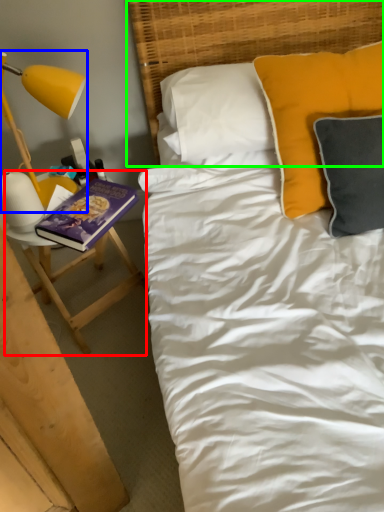
Question: Which is nearer to the table (highlighted by a red box)? lamp (highlighted by a blue box) or headboard (highlighted by a green box).

Choices:
 (A) lamp
 (B) headboard

Answer: (A)